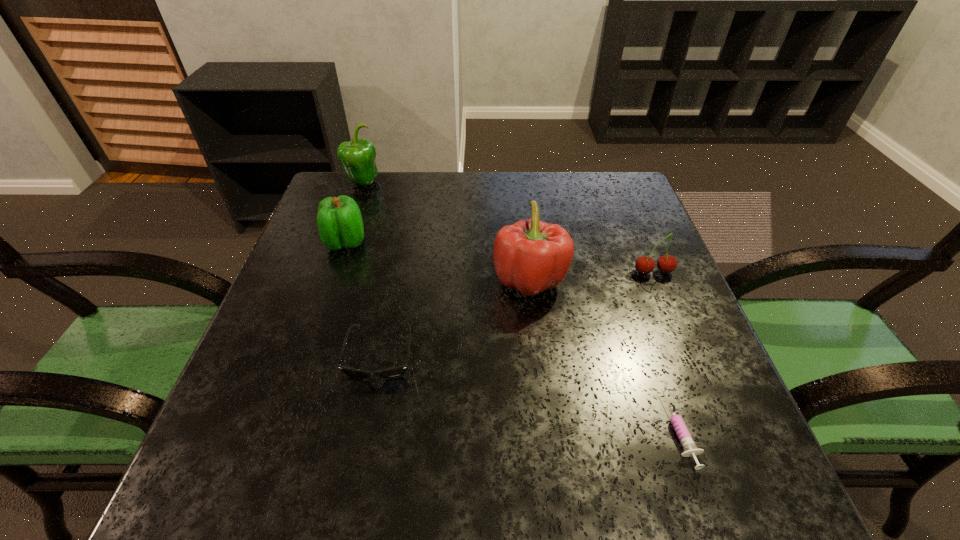
The height and width of the screenshot is (540, 960). Find the location of `the farthest bell pepper`. the farthest bell pepper is located at coordinates (357, 157).

I want to click on the third object from right to left, so click(x=532, y=256).

This screenshot has width=960, height=540. I want to click on the shortest bell pepper, so click(339, 220).

This screenshot has height=540, width=960. In order to click on cherry in this screenshot , I will do pos(667,263).

I want to click on the fifth tallest object, so click(x=391, y=373).

Locate an element on the screen. This screenshot has height=540, width=960. the fourth object from right to left is located at coordinates (391, 373).

The image size is (960, 540). I want to click on the shortest object, so click(x=684, y=436).

Find the location of a particular element. Image resolution: width=960 pixels, height=540 pixels. the nearest object is located at coordinates (684, 436).

Where is `vacant position located on the right of the farthest object`? vacant position located on the right of the farthest object is located at coordinates (441, 183).

Where is `vacant space located 0.120m on the back of the fourth object from left to right`? Image resolution: width=960 pixels, height=540 pixels. vacant space located 0.120m on the back of the fourth object from left to right is located at coordinates [523, 224].